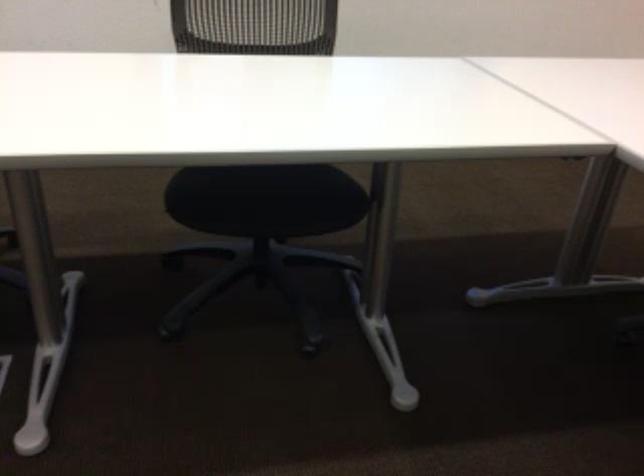
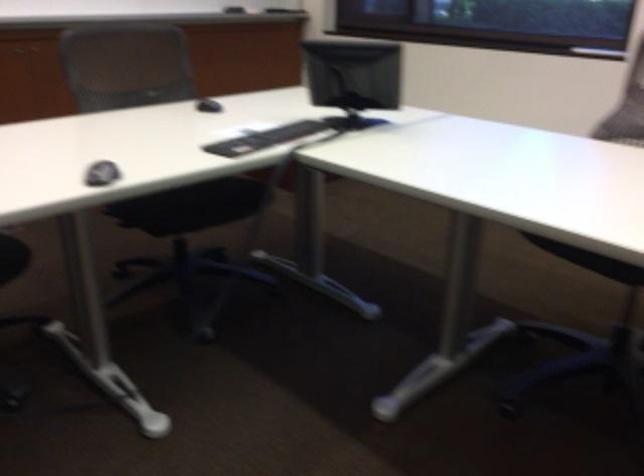
Question: The camera is either moving clockwise (left) or counter-clockwise (right) around the object. The first image is from the beginning of the video and the second image is from the end. Is the camera moving left or right when shooting the video?

Choices:
 (A) Left
 (B) Right

Answer: (B)